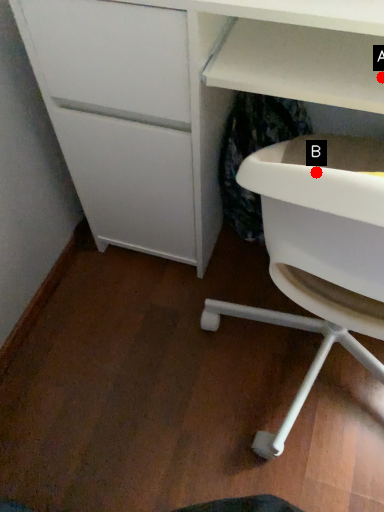
Question: Two points are circled on the image, labeled by A and B beside each circle. Which point is closer to the camera?

Choices:
 (A) A is closer
 (B) B is closer

Answer: (B)